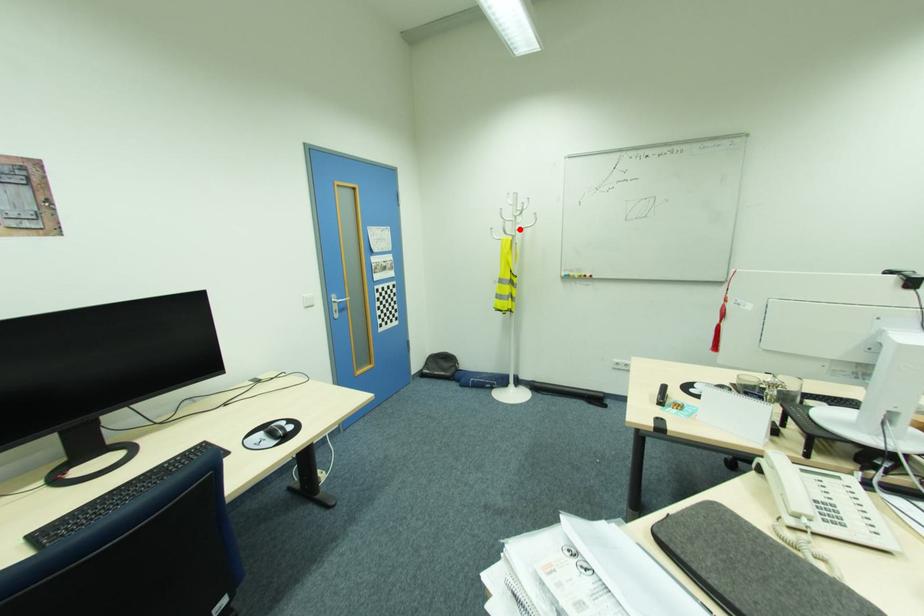
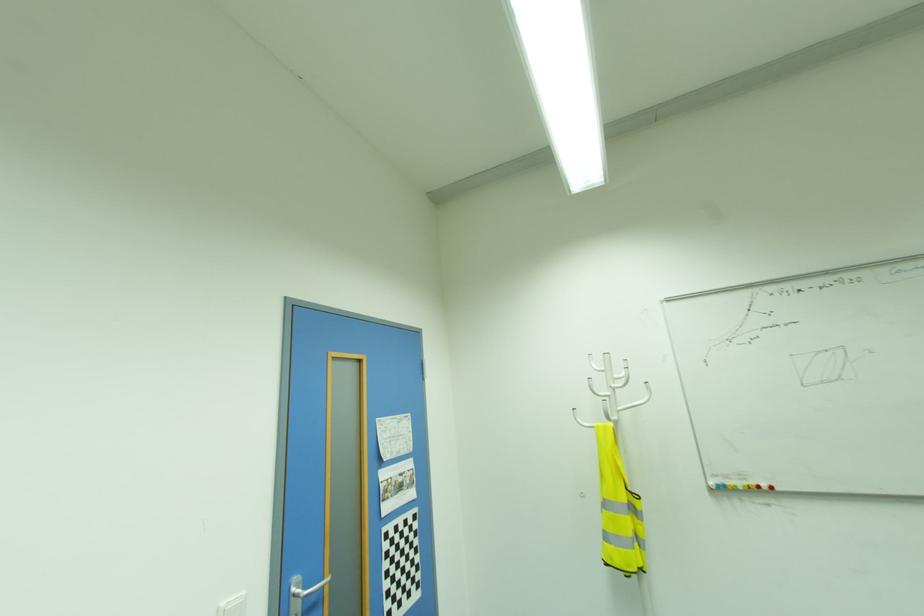
In the second image, find the point that corresponds to the highlighted location in the first image.

(622, 408)